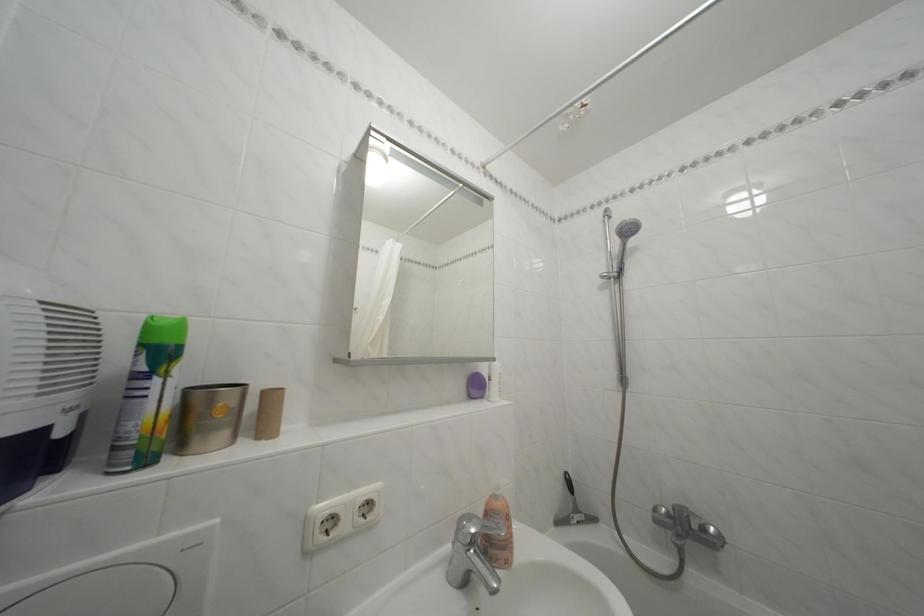
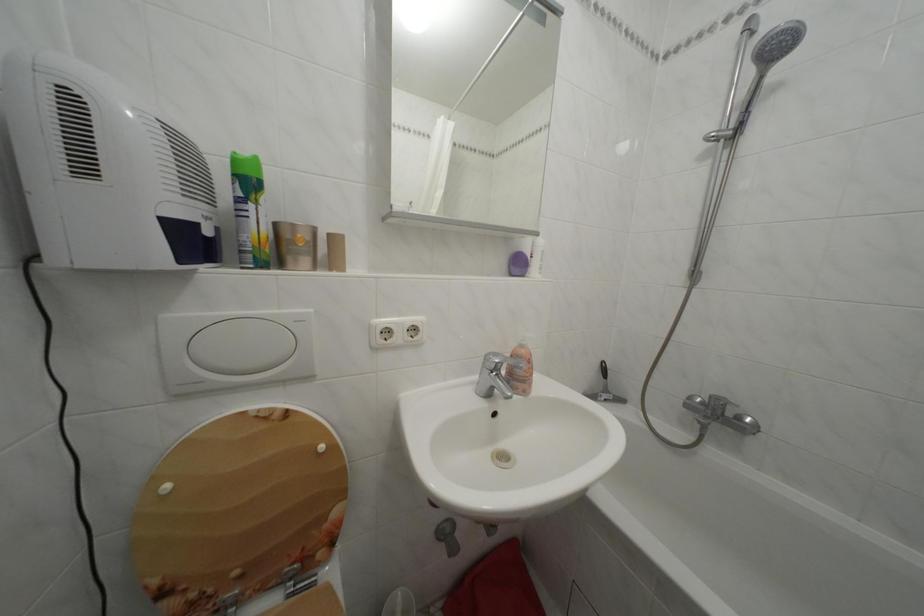
Locate, in the second image, the point that corresponds to the point at 586,517 in the first image.

(614, 397)